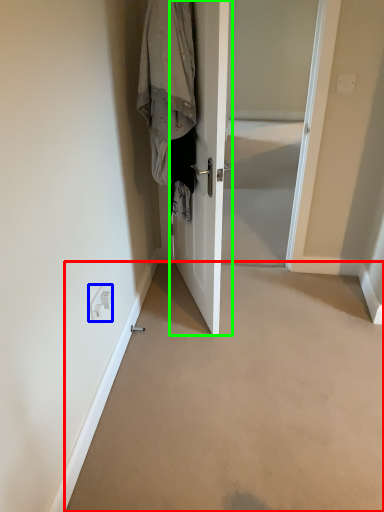
Question: Estimate the real-world distances between objects in this image. Which object is farther from corridor (highlighted by a red box), electric outlet (highlighted by a blue box) or door (highlighted by a green box)?

Choices:
 (A) electric outlet
 (B) door

Answer: (A)